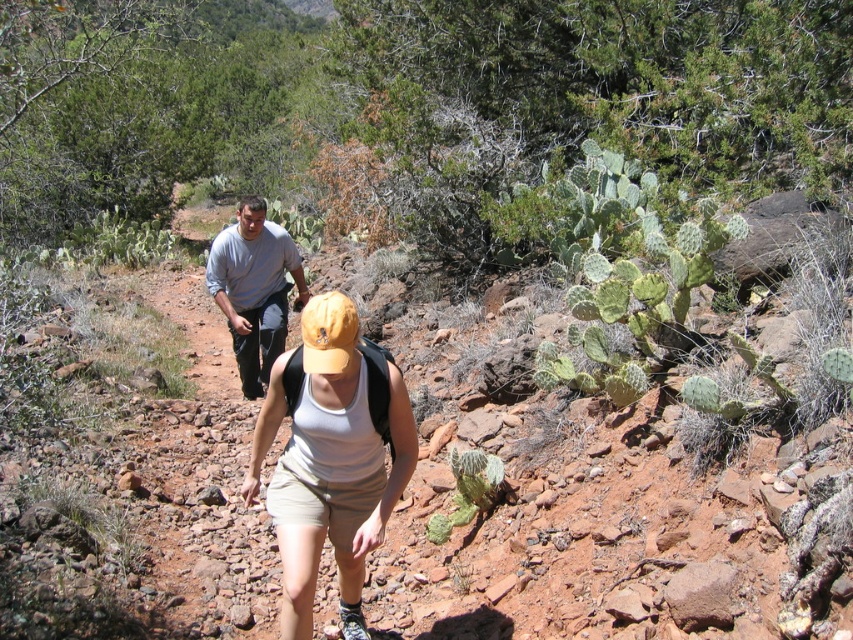
Question: Does gray cotton shirt at upper left have a greater width compared to gray fabric pants at center?

Choices:
 (A) yes
 (B) no

Answer: (B)

Question: Is gray cotton shirt at upper left smaller than gray fabric pants at center?

Choices:
 (A) yes
 (B) no

Answer: (A)

Question: Among these objects, which one is farthest from the camera?

Choices:
 (A) gray fabric pants at center
 (B) gray cotton shirt at upper left

Answer: (A)

Question: Considering the relative positions of gray cotton shirt at upper left and gray fabric pants at center in the image provided, where is gray cotton shirt at upper left located with respect to gray fabric pants at center?

Choices:
 (A) below
 (B) above

Answer: (A)

Question: Among these objects, which one is nearest to the camera?

Choices:
 (A) gray cotton shirt at upper left
 (B) gray fabric pants at center

Answer: (A)

Question: Which object is closer to the camera taking this photo?

Choices:
 (A) gray cotton shirt at upper left
 (B) gray fabric pants at center

Answer: (A)